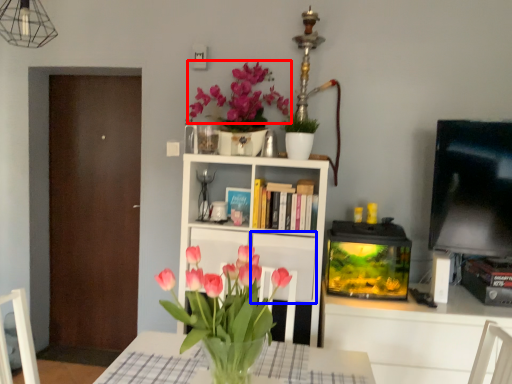
Question: Among these objects, which one is farthest to the camera, flower (highlighted by a red box) or cabinet (highlighted by a blue box)?

Choices:
 (A) flower
 (B) cabinet

Answer: (A)